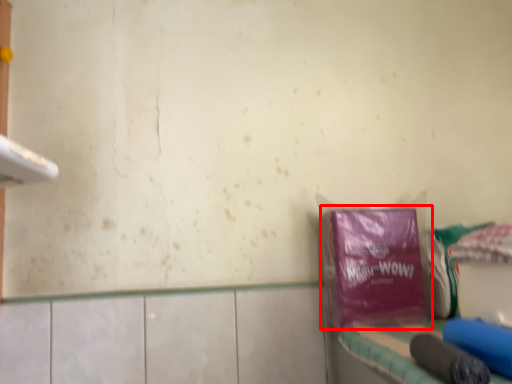
Question: From the image, what is the correct spatial relationship of plastic bag (annotated by the red box) in relation to vanity?

Choices:
 (A) right
 (B) left

Answer: (B)